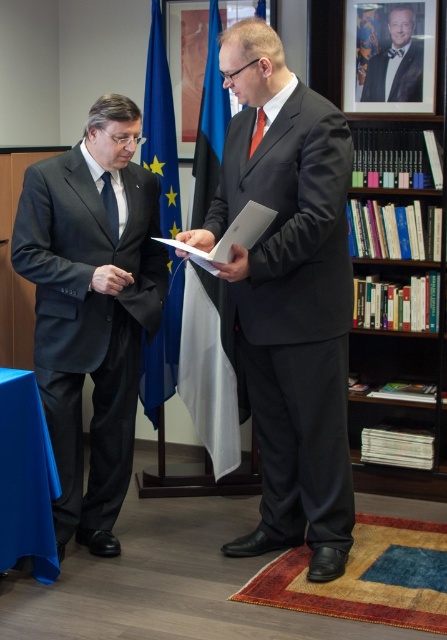
You are a photographer standing in the room and want to take a photo of the matte black suit at left and the brown wooden bookshelf at right. The camera you are using has a maximum focus range of 5 feet. Can you capture both objects in focus without moving the camera?

The matte black suit at left is 5.59 feet from the brown wooden bookshelf at right. Since the distance between them is greater than the camera maximum focus range of 5 feet, you cannot capture both objects in focus without moving the camera.

You are a guest at an event and need to locate the blue fabric flag at center and the black silk tie at left. From the perspective of someone facing the scene, which object is positioned to the right?

The blue fabric flag at center is to the right of the black silk tie at left.

You are an interior designer assessing the space between the matte black suit at left and the brown wooden bookshelf at right. Can you determine which object occupies more visual space in the scene?

The brown wooden bookshelf at right is larger than the matte black suit at left, so it occupies more visual space in the scene.